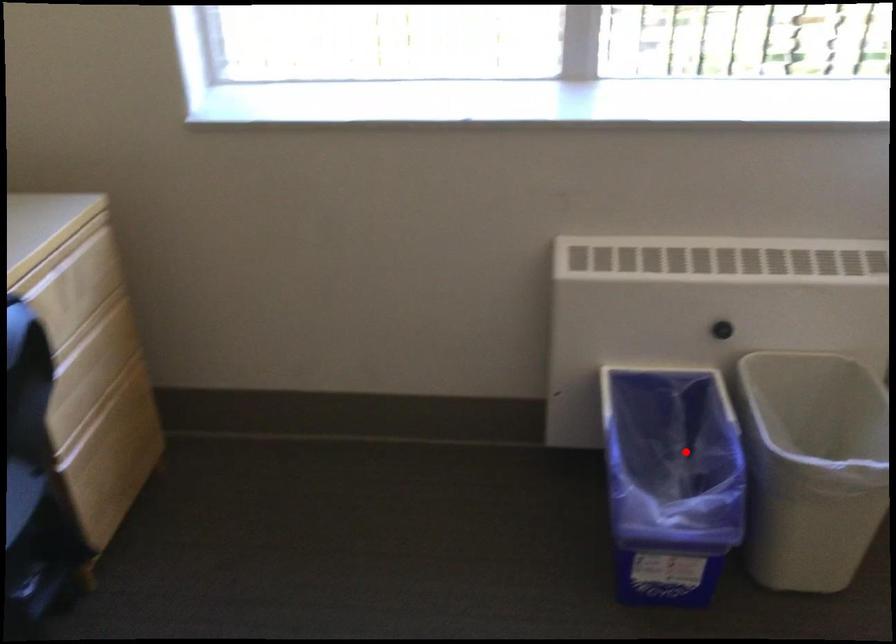
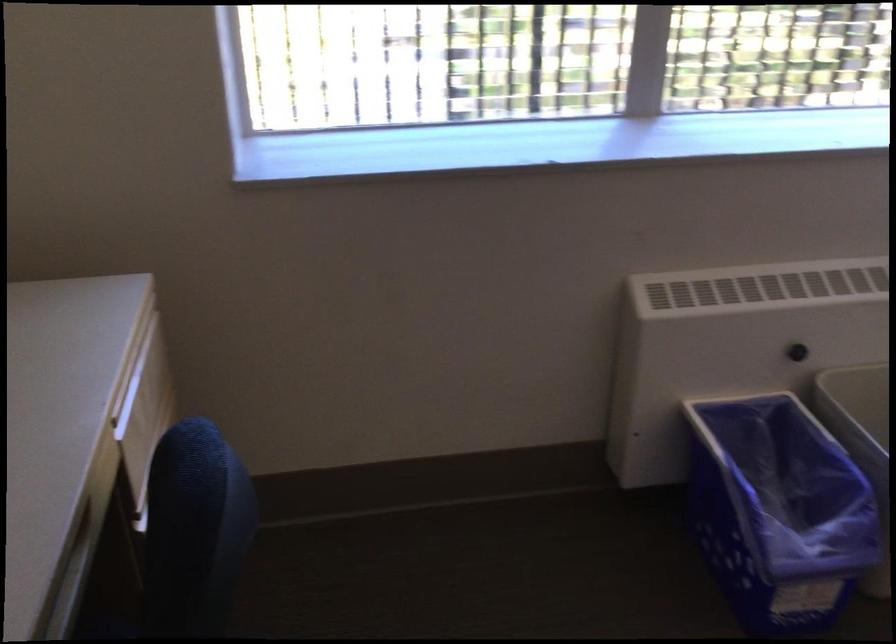
Locate, in the second image, the point that corresponds to the highlighted location in the first image.

(776, 476)